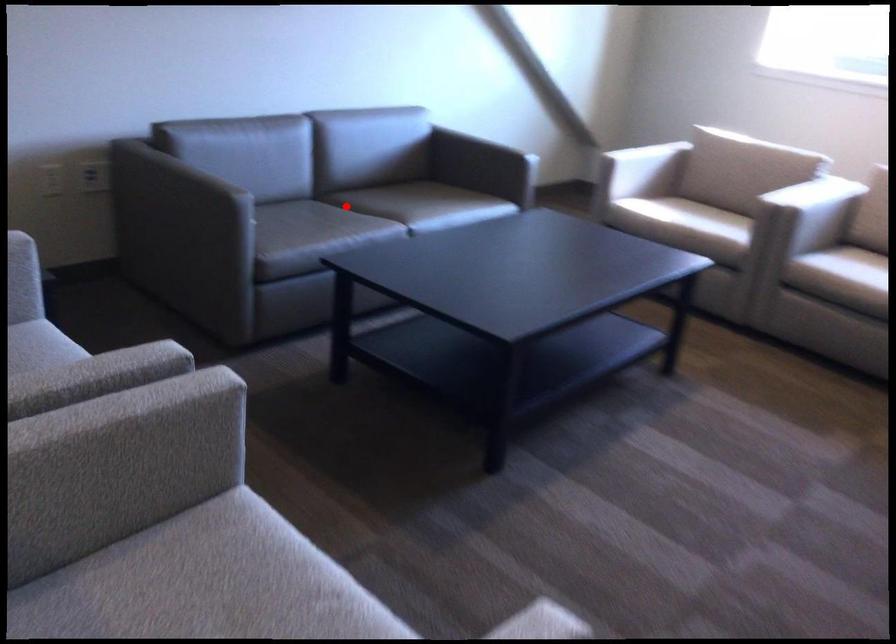
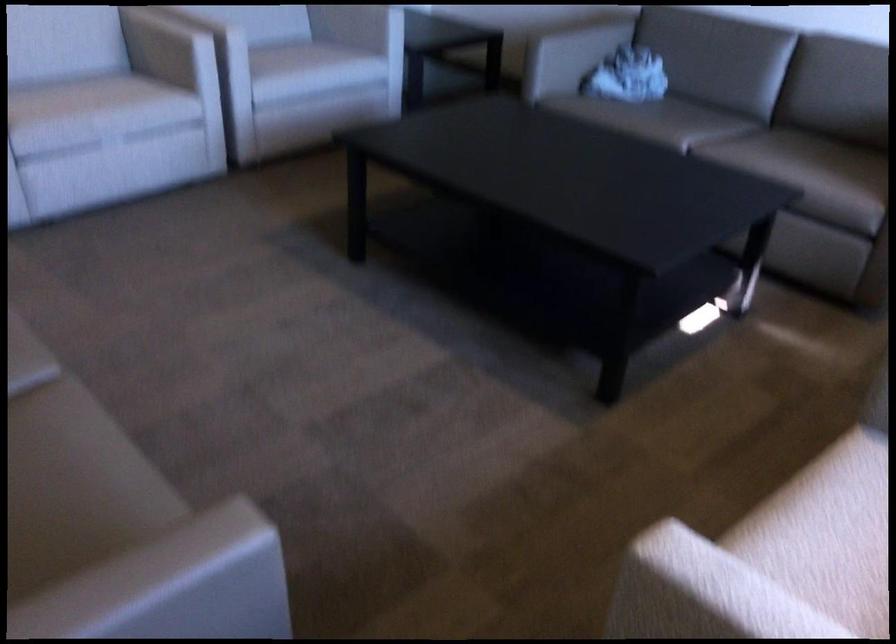
The point at the highlighted location is marked in the first image. Where is the corresponding point in the second image?

(714, 127)